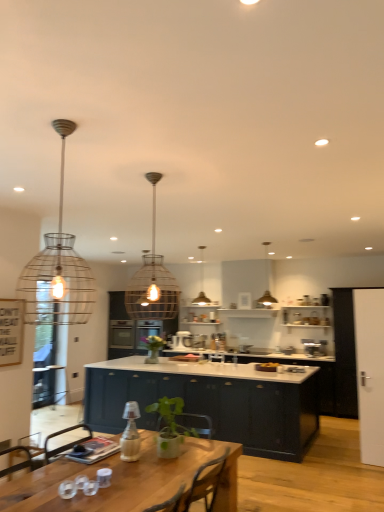
What do you see at coordinates (266, 281) in the screenshot? The width and height of the screenshot is (384, 512). I see `metallic wire pendant light at upper center, the first lamp in the right-to-left sequence` at bounding box center [266, 281].

You are a GUI agent. You are given a task and a screenshot of the screen. Output one action in this format:
    pyautogui.click(x=<x>, y=<y>)
    Task: Click on the satin silver mixer at center, which is counted as the first appliance, starting from the left
    
    Given the screenshot: What is the action you would take?
    pyautogui.click(x=182, y=339)

Based on the photo, in order to face wire mesh pendant light at center, the third lamp in the right-to-left sequence, should I rotate leftwards or rightwards?

Rotate left and turn 5.496 degrees.

How much space does wire mesh pendant light at center, the second lamp in the left-to-right sequence, occupy horizontally?

15.36 inches.

What is the approximate height of white glossy door at right?

The height of white glossy door at right is 1.99 meters.

The image size is (384, 512). What do you see at coordinates (58, 270) in the screenshot? I see `wire mesh pendant light at upper left, the fourth lamp from the back` at bounding box center [58, 270].

In order to face wooden table at lower left, should I rotate leftwards or rightwards?

To align with it, rotate left about 9.012°.

Image resolution: width=384 pixels, height=512 pixels. I want to click on metallic wire pendant light at upper center, which is counted as the second lamp, starting from the back, so click(266, 281).

Which object is closer to the camera taking this photo, satin silver mixer at center, acting as the 2th appliance starting from the right, or metallic wire pendant light at upper center, which is the 4th lamp from left to right?

metallic wire pendant light at upper center, which is the 4th lamp from left to right, is in front.

Find the location of `the 2nd lamp to the right of the satin silver mixer at center, which is the 1th appliance from back to front, starting your count from the anchor`. the 2nd lamp to the right of the satin silver mixer at center, which is the 1th appliance from back to front, starting your count from the anchor is located at coordinates (266, 281).

Is satin silver mixer at center, which is the 1th appliance from back to front, thinner than metallic wire pendant light at upper center, which is counted as the second lamp, starting from the back?

Yes.

Locate an element on the screen. This screenshot has width=384, height=512. cabinetry in front of the green matte vase at center, marked as the first plant in a back-to-front arrangement is located at coordinates (211, 401).

Which is correct: glossy dark blue cabinet at center, which appears as the second cabinetry when viewed from the back, is inside green matte vase at center, marked as the first plant in a back-to-front arrangement, or outside of it?

glossy dark blue cabinet at center, which appears as the second cabinetry when viewed from the back, exists outside the volume of green matte vase at center, marked as the first plant in a back-to-front arrangement.

Considering the points (147, 401) and (151, 349), which point is behind, point (147, 401) or point (151, 349)?

Positioned behind is point (151, 349).

Based on the photo, considering the relative positions of blue matte cabinet at center, acting as the first cabinetry starting from the back, and glossy dark blue cabinet at center, which appears as the second cabinetry when viewed from the back, in the image provided, is blue matte cabinet at center, acting as the first cabinetry starting from the back, to the left or to the right of glossy dark blue cabinet at center, which appears as the second cabinetry when viewed from the back,?

From the image, it's evident that blue matte cabinet at center, acting as the first cabinetry starting from the back, is to the left of glossy dark blue cabinet at center, which appears as the second cabinetry when viewed from the back.

Is the position of blue matte cabinet at center, which is counted as the 2th cabinetry, starting from the front, less distant than that of glossy dark blue cabinet at center, which appears as the first cabinetry when viewed from the front?

No, the depth of blue matte cabinet at center, which is counted as the 2th cabinetry, starting from the front, is greater than that of glossy dark blue cabinet at center, which appears as the first cabinetry when viewed from the front.

From a real-world perspective, is blue matte cabinet at center, which is counted as the 2th cabinetry, starting from the front, below glossy dark blue cabinet at center, which appears as the second cabinetry when viewed from the back?

No, from a real-world perspective, blue matte cabinet at center, which is counted as the 2th cabinetry, starting from the front, is not beneath glossy dark blue cabinet at center, which appears as the second cabinetry when viewed from the back.

Considering the sizes of objects glossy dark blue cabinet at center, which appears as the second cabinetry when viewed from the back, and green leafy plant at center, marked as the first plant in a front-to-back arrangement, in the image provided, who is smaller, glossy dark blue cabinet at center, which appears as the second cabinetry when viewed from the back, or green leafy plant at center, marked as the first plant in a front-to-back arrangement,?

green leafy plant at center, marked as the first plant in a front-to-back arrangement.

From the image's perspective, which is below, glossy dark blue cabinet at center, which appears as the second cabinetry when viewed from the back, or green leafy plant at center, which is the 2th plant from back to front?

glossy dark blue cabinet at center, which appears as the second cabinetry when viewed from the back, appears lower in the image.

From the image's perspective, count 2nd cabinetrys downward from the green leafy plant at center, the second plant in the left-to-right sequence, and point to it. Please provide its 2D coordinates.

[(211, 401)]

Would you say metallic wire pendant light at center, the 1th lamp positioned from the back, is part of green matte vase at center, placed as the 2th plant when sorted from right to left,'s contents?

No, metallic wire pendant light at center, the 1th lamp positioned from the back, is not a part of green matte vase at center, placed as the 2th plant when sorted from right to left.

The width and height of the screenshot is (384, 512). What are the coordinates of `the 1st lamp in front of the green matte vase at center, positioned as the 2th plant in front-to-back order, starting your count from the anchor` in the screenshot? It's located at (201, 281).

From the picture: Is green matte vase at center, which appears as the first plant when viewed from the left, beside metallic wire pendant light at center, the 3th lamp viewed from the left?

No.

Is green matte vase at center, placed as the 2th plant when sorted from right to left, bigger or smaller than metallic wire pendant light at center, arranged as the 2th lamp when viewed from the right?

Clearly, green matte vase at center, placed as the 2th plant when sorted from right to left, is larger in size than metallic wire pendant light at center, arranged as the 2th lamp when viewed from the right.

Considering the sizes of metallic wire pendant light at center, the 3th lamp viewed from the left, and wooden table at lower left in the image, is metallic wire pendant light at center, the 3th lamp viewed from the left, bigger or smaller than wooden table at lower left?

Considering their sizes, metallic wire pendant light at center, the 3th lamp viewed from the left, takes up less space than wooden table at lower left.

Can you tell me how much metallic wire pendant light at center, arranged as the 2th lamp when viewed from the right, and wooden table at lower left differ in facing direction?

The facing directions of metallic wire pendant light at center, arranged as the 2th lamp when viewed from the right, and wooden table at lower left are 177 degrees apart.

Is metallic wire pendant light at center, acting as the fourth lamp starting from the front, with wooden table at lower left?

No, metallic wire pendant light at center, acting as the fourth lamp starting from the front, is not touching wooden table at lower left.

Is metallic wire pendant light at center, the 3th lamp viewed from the left, in front of or behind wooden table at lower left in the image?

In the image, metallic wire pendant light at center, the 3th lamp viewed from the left, appears behind wooden table at lower left.

Considering the relative sizes of wire mesh pendant light at center, positioned as the 3th lamp in back-to-front order, and wire mesh pendant light at upper left, which is the fourth lamp from right to left, in the image provided, is wire mesh pendant light at center, positioned as the 3th lamp in back-to-front order, bigger than wire mesh pendant light at upper left, which is the fourth lamp from right to left,?

Correct, wire mesh pendant light at center, positioned as the 3th lamp in back-to-front order, is larger in size than wire mesh pendant light at upper left, which is the fourth lamp from right to left.

Could you tell me if wire mesh pendant light at center, positioned as the 3th lamp in back-to-front order, is turned towards wire mesh pendant light at upper left, the 1th lamp in the front-to-back sequence?

Yes, wire mesh pendant light at center, positioned as the 3th lamp in back-to-front order, is aimed at wire mesh pendant light at upper left, the 1th lamp in the front-to-back sequence.

Is wire mesh pendant light at upper left, the 1th lamp in the front-to-back sequence, inside wire mesh pendant light at center, the 2th lamp in the front-to-back sequence?

No, wire mesh pendant light at upper left, the 1th lamp in the front-to-back sequence, is located outside of wire mesh pendant light at center, the 2th lamp in the front-to-back sequence.

From the image's perspective, which lamp is the 1st one below the wire mesh pendant light at upper left, the 1th lamp in the front-to-back sequence? Please provide its 2D coordinates.

[(152, 280)]

Locate an element on the screen. The width and height of the screenshot is (384, 512). the 2nd lamp in front of the satin silver mixer at center, which is the 1th appliance from back to front is located at coordinates (266, 281).

Which plant is the 2nd one when counting from the left side of the glossy dark blue cabinet at center, which appears as the second cabinetry when viewed from the back? Please provide its 2D coordinates.

[(153, 348)]

Based on their spatial positions, is green matte vase at center, placed as the 2th plant when sorted from right to left, or metallic wire pendant light at upper center, which ranks as the third lamp in front-to-back order, further from glossy dark blue cabinet at center, which appears as the second cabinetry when viewed from the back?

Based on the image, metallic wire pendant light at upper center, which ranks as the third lamp in front-to-back order, appears to be further to glossy dark blue cabinet at center, which appears as the second cabinetry when viewed from the back.

Looking at this image, when comparing their distances from wooden table at lower left, does satin silver toaster at center, which appears as the 1th appliance when viewed from the front, or glossy dark blue cabinet at center, which appears as the second cabinetry when viewed from the back, seem further?

satin silver toaster at center, which appears as the 1th appliance when viewed from the front, is positioned further to the anchor wooden table at lower left.

Based on their spatial positions, is white glossy door at right or wire mesh pendant light at center, the second lamp in the left-to-right sequence, further from metallic wire pendant light at center, the 3th lamp viewed from the left?

The object further to metallic wire pendant light at center, the 3th lamp viewed from the left, is white glossy door at right.

Looking at the image, which one is located further to metallic wire pendant light at center, the 1th lamp positioned from the back, metallic wire pendant light at upper center, which is the 4th lamp from left to right, or white glossy door at right?

Based on the image, white glossy door at right appears to be further to metallic wire pendant light at center, the 1th lamp positioned from the back.

From the image, which object appears to be farther from glossy dark blue cabinet at center, which appears as the second cabinetry when viewed from the back, blue matte cabinet at center, acting as the first cabinetry starting from the back, or satin silver toaster at center, the 2th appliance viewed from the back?

satin silver toaster at center, the 2th appliance viewed from the back, is further to glossy dark blue cabinet at center, which appears as the second cabinetry when viewed from the back.

When comparing their distances from white glossy door at right, does metallic wire pendant light at upper center, which is counted as the second lamp, starting from the back, or wire mesh pendant light at upper left, the fourth lamp from the back, seem closer?

metallic wire pendant light at upper center, which is counted as the second lamp, starting from the back, lies closer to white glossy door at right than the other object.

Looking at the image, which one is located further to white glossy door at right, wooden table at lower left or green leafy plant at center, which is the first plant from right to left?

wooden table at lower left is positioned further to the anchor white glossy door at right.

From the image, which object appears to be farther from metallic wire pendant light at center, the 1th lamp positioned from the back, white glossy door at right or wire mesh pendant light at upper left, the fourth lamp from the back?

The object further to metallic wire pendant light at center, the 1th lamp positioned from the back, is white glossy door at right.

What are the coordinates of `lamp located between green leafy plant at center, which is the first plant from right to left, and metallic wire pendant light at center, the 1th lamp positioned from the back, in the depth direction` in the screenshot? It's located at (266, 281).

Identify the location of appliance located between wire mesh pendant light at center, the 2th lamp in the front-to-back sequence, and satin silver mixer at center, which is the second appliance in front-to-back order, in the depth direction. (314, 347).

At what (x,y) coordinates should I click in order to perform the action: click on glass door between green leafy plant at center, which is the 2th plant from back to front, and satin silver mixer at center, acting as the 2th appliance starting from the right, along the z-axis. Please return your answer as a coordinate pair (x, y). Looking at the image, I should click on (370, 372).

Find the location of `plant between metallic wire pendant light at upper center, which is counted as the second lamp, starting from the back, and satin silver mixer at center, which is the 1th appliance from back to front, from front to back`. plant between metallic wire pendant light at upper center, which is counted as the second lamp, starting from the back, and satin silver mixer at center, which is the 1th appliance from back to front, from front to back is located at coordinates (153, 348).